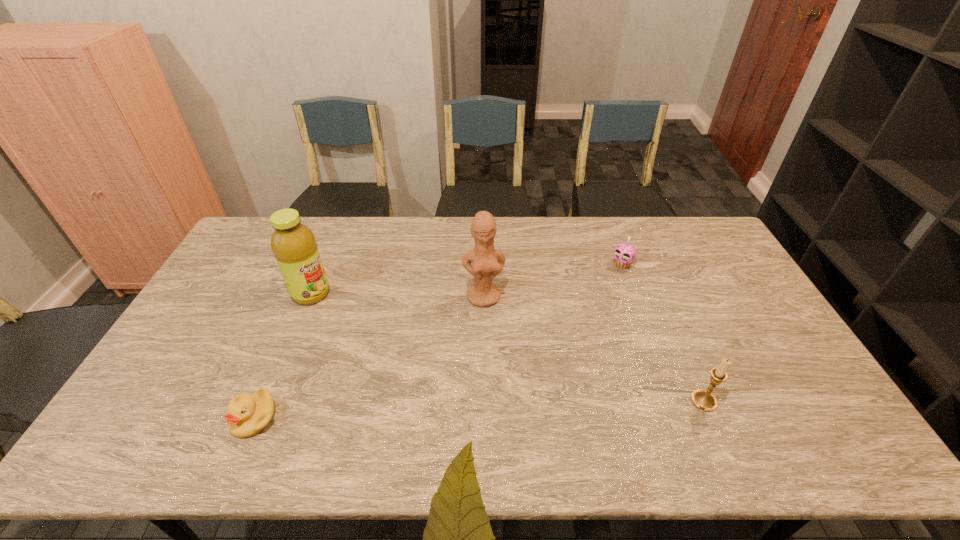
Locate an element on the screen. vacant area between the rightmost object and the fruit juice is located at coordinates (508, 347).

The width and height of the screenshot is (960, 540). I want to click on free spot between the fruit juice and the third shortest object, so click(508, 347).

Find the location of `empty location between the third object from right to left and the fruit juice`. empty location between the third object from right to left and the fruit juice is located at coordinates (397, 295).

Locate an element on the screen. The image size is (960, 540). blank region between the fruit juice and the rightmost object is located at coordinates (x=508, y=347).

Identify which object is located as the fourth nearest to the shortest object. Please provide its 2D coordinates. Your answer should be formatted as a tuple, i.e. [(x, y)], where the tuple contains the x and y coordinates of a point satisfying the conditions above.

[(624, 254)]

Where is `the second closest object to the cupcake`? the second closest object to the cupcake is located at coordinates (702, 399).

This screenshot has width=960, height=540. Find the location of `vacant region that satisfies the following two spatial constraints: 1. on the back side of the figurine; 2. on the left side of the fourth object from left to right`. vacant region that satisfies the following two spatial constraints: 1. on the back side of the figurine; 2. on the left side of the fourth object from left to right is located at coordinates pos(483,265).

Identify the location of vacant area in the image that satisfies the following two spatial constraints: 1. on the front side of the fruit juice; 2. on the right side of the candle holder. (268, 401).